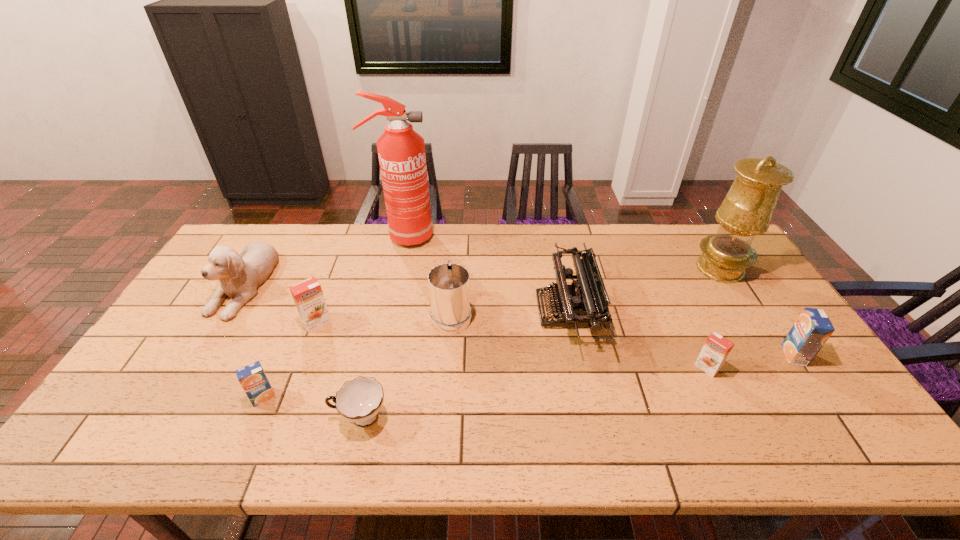
This screenshot has width=960, height=540. Find the location of `vacant space that satisfies the following two spatial constraints: 1. at the nozzle of the tallest object; 2. on the left side of the right blue orange_juice`. vacant space that satisfies the following two spatial constraints: 1. at the nozzle of the tallest object; 2. on the left side of the right blue orange_juice is located at coordinates (376, 355).

This screenshot has height=540, width=960. In order to click on vacant position in the image that satisfies the following two spatial constraints: 1. on the side of the mug with the handle; 2. on the left side of the oil lamp in this screenshot , I will do `click(455, 268)`.

The width and height of the screenshot is (960, 540). Find the location of `free space that satisfies the following two spatial constraints: 1. on the back side of the nearer blue orange_juice; 2. on the left side of the rightmost orange_juice`. free space that satisfies the following two spatial constraints: 1. on the back side of the nearer blue orange_juice; 2. on the left side of the rightmost orange_juice is located at coordinates (281, 355).

This screenshot has height=540, width=960. In order to click on free space that satisfies the following two spatial constraints: 1. on the side of the white cup with the handle; 2. on the back side of the rightmost orange_juice in this screenshot , I will do `click(374, 355)`.